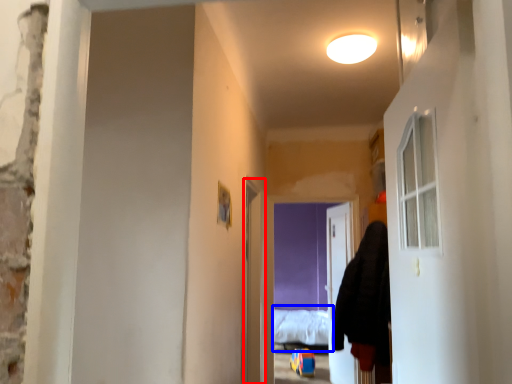
Question: Which object appears farthest to the camera in this image, screen door (highlighted by a red box) or bed (highlighted by a blue box)?

Choices:
 (A) screen door
 (B) bed

Answer: (B)